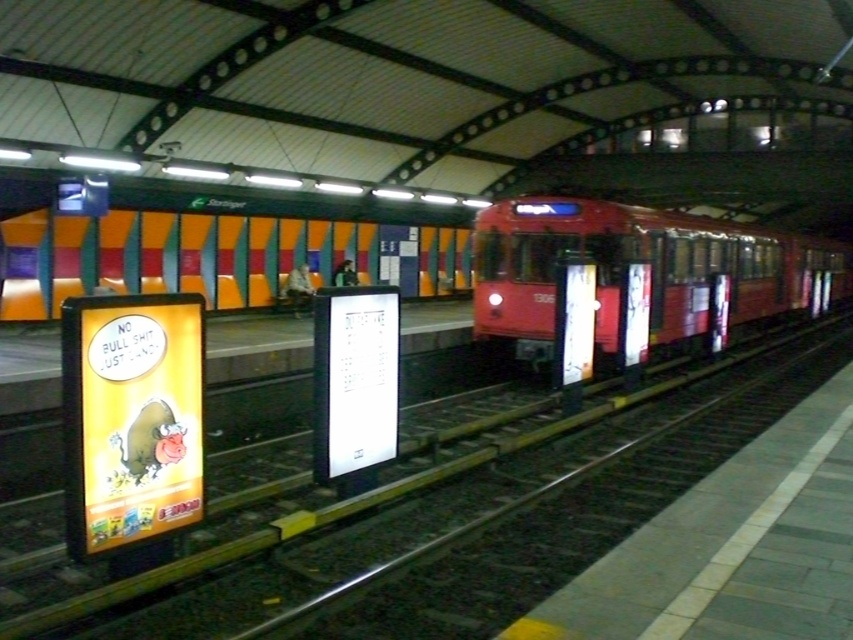
Is metal at left above matte red train at center?

Actually, metal at left is below matte red train at center.

Describe the element at coordinates (462, 516) in the screenshot. I see `metal at left` at that location.

Where is `metal at left`? This screenshot has height=640, width=853. metal at left is located at coordinates (462, 516).